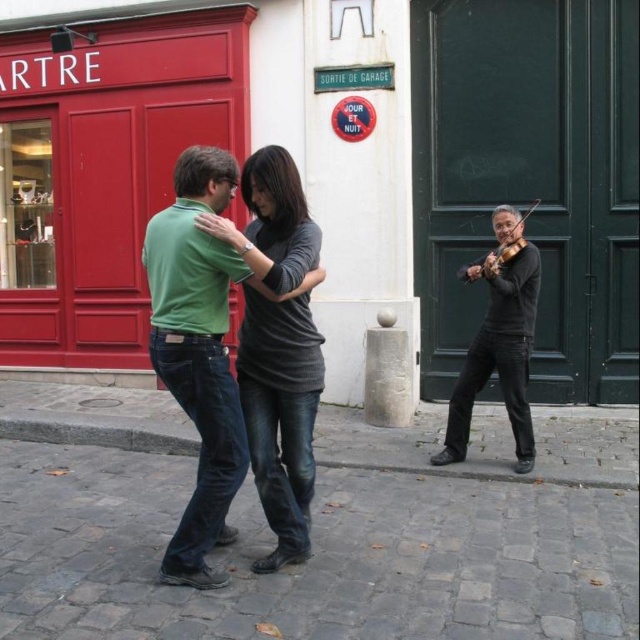
You are standing on the cobblestone street in front of the red storefront with the word ARTRE. There are two points marked in the scene. Which point is closer to you, point (476, 520) or point (244, 250)?

Point (244, 250) is closer to you because it is less far from the camera than point (476, 520).

Looking at this image, you are standing at the point labeled as point (314, 547) on the gray cobblestone pavement at lower center. If you look straight ahead, which direction do you face? The street extends to the right towards the red storefront on the left side of the frame and the dancing couple in the center. The cobblestone path continues straight ahead. Please choose from the options below. A. Towards the red storefront on the left. B. Towards the dancing couple in the center. C. Straight ahead along the gray cobblestone.

C. Straight ahead along the gray cobblestone.